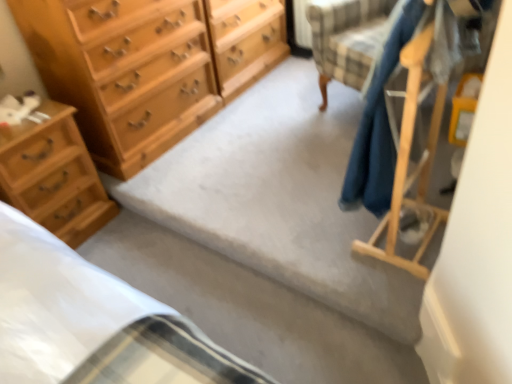
Question: Would you consider light brown wood chest of drawers at left, the 1th chest of drawers from the bottom, to be distant from carpet at center?

Choices:
 (A) no
 (B) yes

Answer: (A)

Question: Is light brown wood chest of drawers at left, the 1th chest of drawers from the bottom, to the left of carpet at center from the viewer's perspective?

Choices:
 (A) no
 (B) yes

Answer: (B)

Question: Is light brown wood chest of drawers at left, the 1th chest of drawers from the bottom, positioned in front of carpet at center?

Choices:
 (A) no
 (B) yes

Answer: (A)

Question: Is the surface of light brown wood chest of drawers at left, the 1th chest of drawers from the bottom, in direct contact with carpet at center?

Choices:
 (A) no
 (B) yes

Answer: (A)

Question: Does light brown wood chest of drawers at left, the 1th chest of drawers from the bottom, appear on the right side of carpet at center?

Choices:
 (A) yes
 (B) no

Answer: (B)

Question: Does light brown wood chest of drawers at left, the second chest of drawers in the top-to-bottom sequence, have a smaller size compared to carpet at center?

Choices:
 (A) no
 (B) yes

Answer: (A)

Question: Is wooden coat rack at right thinner than light wood chest of drawers at left, the first chest of drawers in the top-to-bottom sequence?

Choices:
 (A) yes
 (B) no

Answer: (A)

Question: Is light wood chest of drawers at left, the first chest of drawers in the top-to-bottom sequence, a part of wooden coat rack at right?

Choices:
 (A) yes
 (B) no

Answer: (B)

Question: Is wooden coat rack at right to the left of light wood chest of drawers at left, acting as the second chest of drawers starting from the bottom, from the viewer's perspective?

Choices:
 (A) no
 (B) yes

Answer: (A)

Question: Are wooden coat rack at right and light wood chest of drawers at left, acting as the second chest of drawers starting from the bottom, located far from each other?

Choices:
 (A) no
 (B) yes

Answer: (B)

Question: From the image's perspective, is wooden coat rack at right over light wood chest of drawers at left, the first chest of drawers in the top-to-bottom sequence?

Choices:
 (A) yes
 (B) no

Answer: (B)

Question: Could you tell me if wooden coat rack at right is facing light wood chest of drawers at left, the first chest of drawers in the top-to-bottom sequence?

Choices:
 (A) no
 (B) yes

Answer: (B)

Question: Considering the relative sizes of wooden coat rack at right and light brown wood chest of drawers at left, the 1th chest of drawers from the bottom, in the image provided, is wooden coat rack at right smaller than light brown wood chest of drawers at left, the 1th chest of drawers from the bottom,?

Choices:
 (A) yes
 (B) no

Answer: (B)